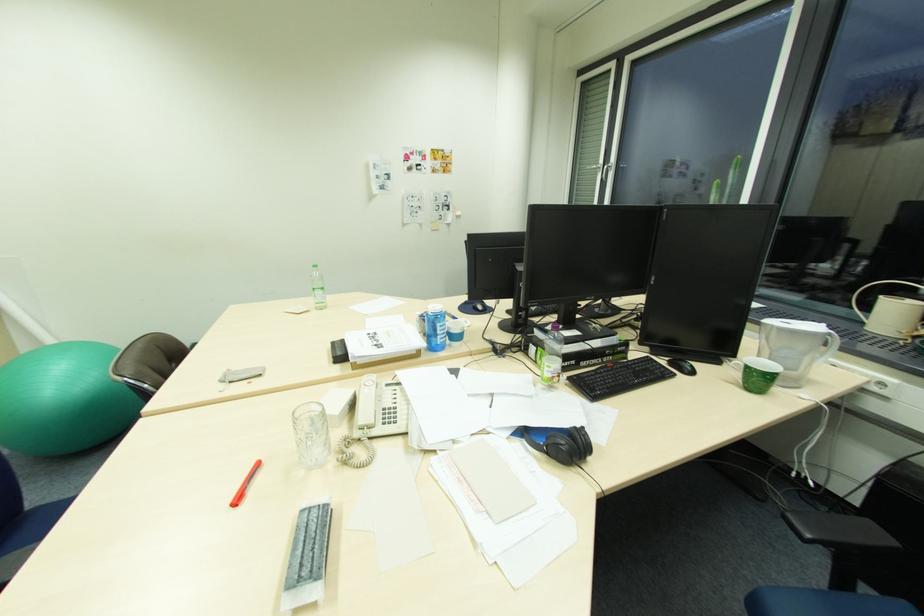
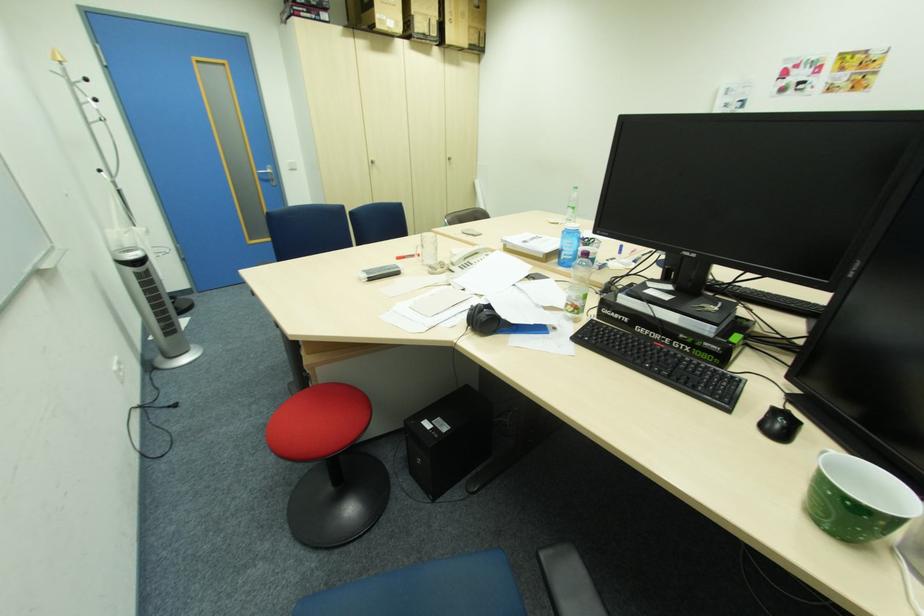
The point at (390, 410) is marked in the first image. Where is the corresponding point in the second image?

(475, 262)